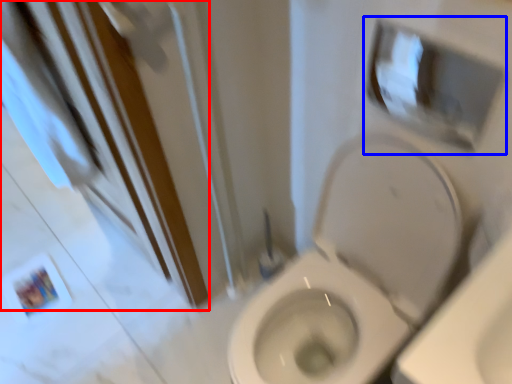
Question: Among these objects, which one is farthest to the camera, screen door (highlighted by a red box) or medicine cabinet (highlighted by a blue box)?

Choices:
 (A) screen door
 (B) medicine cabinet

Answer: (B)